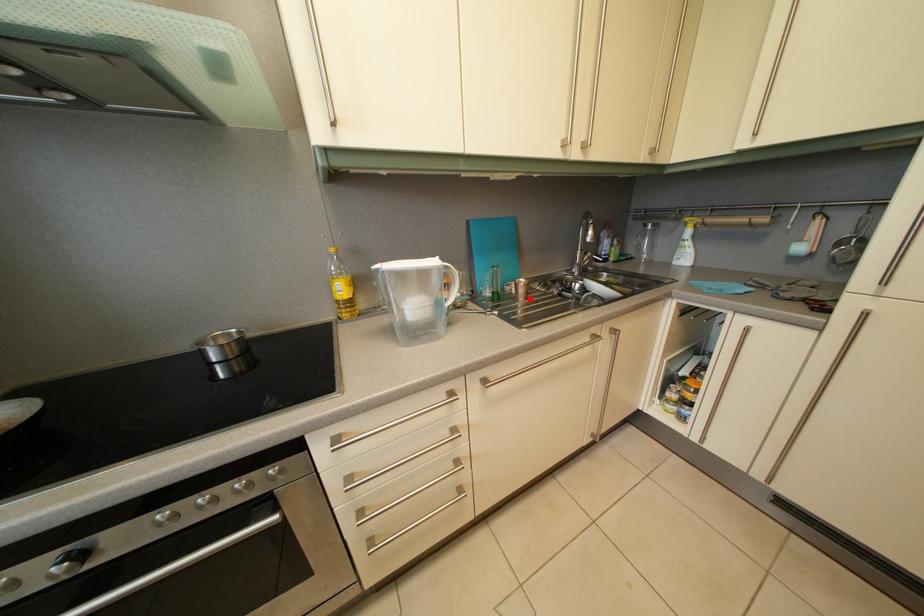
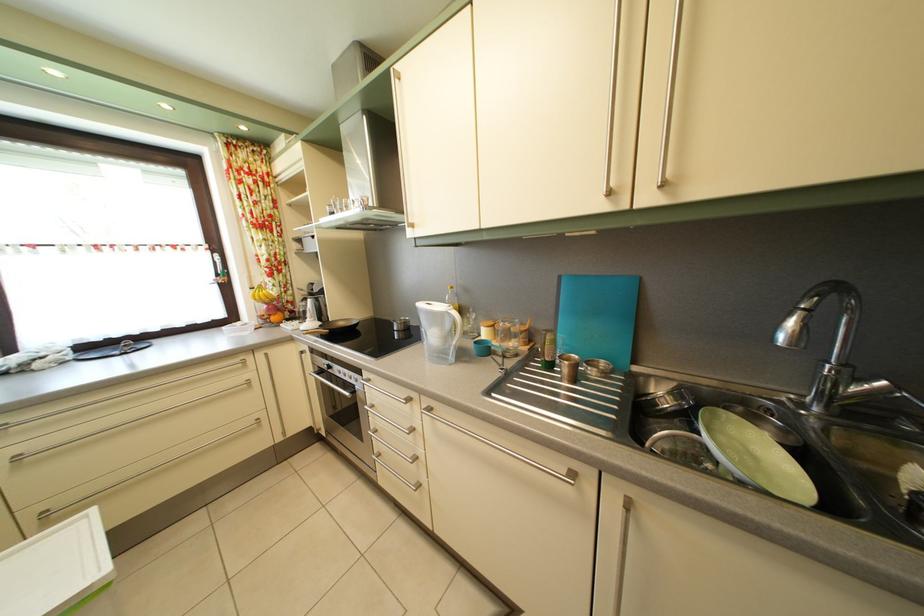
Locate, in the second image, the point that corresponds to the highlighted location in the first image.

(574, 378)